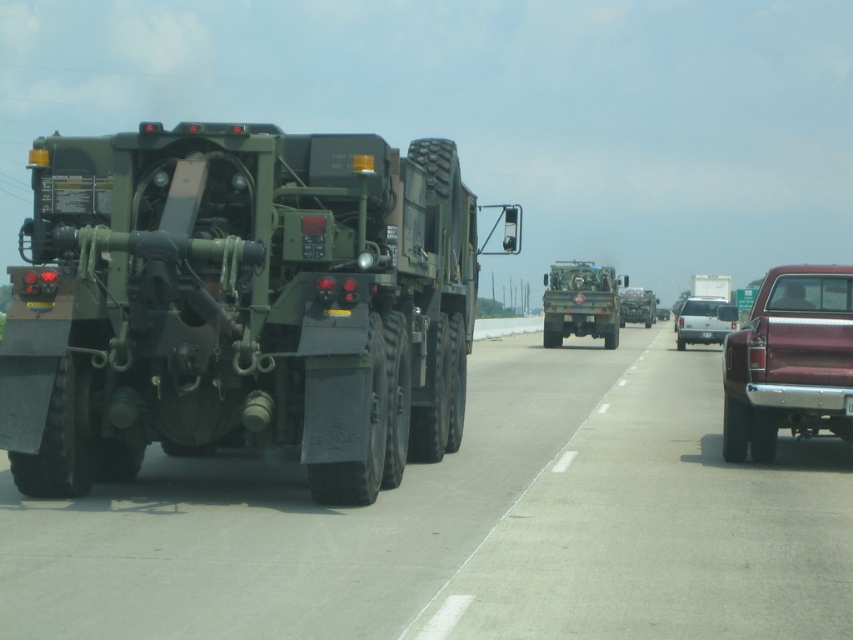
Question: Is maroon metallic truck at right wider than metallic silver trailer at center?

Choices:
 (A) yes
 (B) no

Answer: (B)

Question: Which point is closer to the camera?

Choices:
 (A) (711, 340)
 (B) (749, 376)
 (C) (73, 426)
 (D) (581, 262)

Answer: (C)

Question: Can you confirm if matte green truck at center is positioned to the right of metallic silver trailer at center?

Choices:
 (A) yes
 (B) no

Answer: (B)

Question: Which point is farther to the camera?

Choices:
 (A) (198, 198)
 (B) (578, 275)
 (C) (625, 288)

Answer: (C)

Question: From the image, what is the correct spatial relationship of matte green military vehicle at left in relation to white matte van at center?

Choices:
 (A) right
 (B) left

Answer: (B)

Question: Which object is positioned closest to the maroon metallic truck at right?

Choices:
 (A) matte green truck at center
 (B) white matte van at center
 (C) metallic silver trailer at center
 (D) matte green military vehicle at left

Answer: (D)